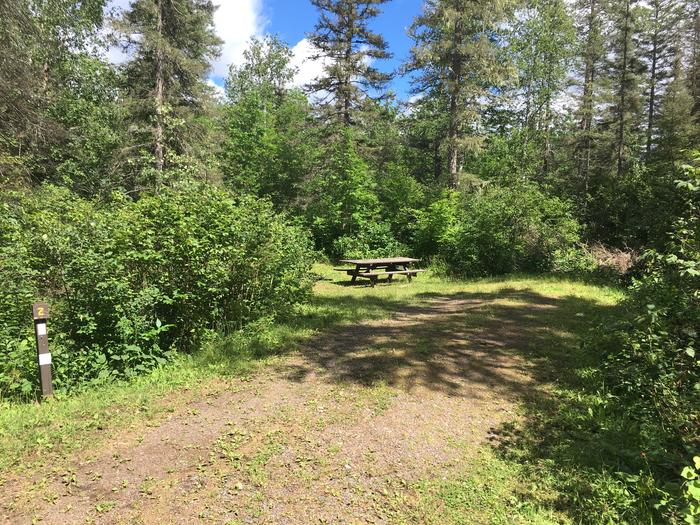
You are a GUI agent. You are given a task and a screenshot of the screen. Output one action in this format:
    pyautogui.click(x=<x>, y=<y>)
    Task: Click on the bench
    The width and height of the screenshot is (700, 525).
    Given the screenshot: What is the action you would take?
    point(386,260)